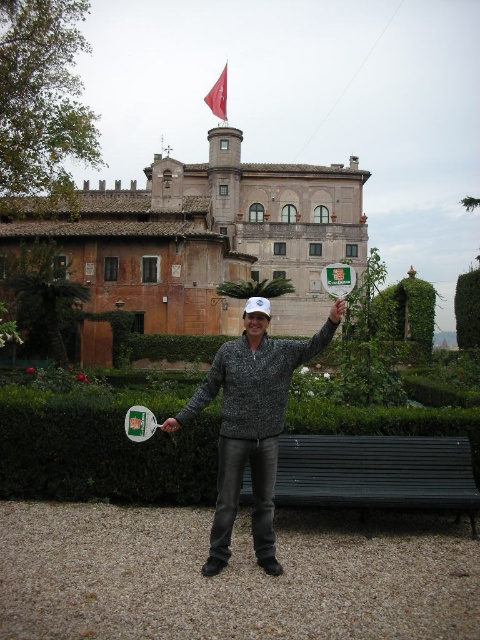
Does brown stone building at upper center have a larger size compared to red fabric flag at upper center?

Indeed, brown stone building at upper center has a larger size compared to red fabric flag at upper center.

Which is above, brown stone building at upper center or red fabric flag at upper center?

red fabric flag at upper center is above.

Describe the element at coordinates (207, 237) in the screenshot. I see `brown stone building at upper center` at that location.

Identify the location of brown stone building at upper center. (207, 237).

Can you confirm if black metal bench at lower center is bigger than red fabric flag at upper center?

No, black metal bench at lower center is not bigger than red fabric flag at upper center.

Which of these two, black metal bench at lower center or red fabric flag at upper center, stands taller?

With more height is red fabric flag at upper center.

Does point (298, 465) come behind point (225, 81)?

No.

Locate an element on the screen. black metal bench at lower center is located at coordinates (377, 474).

Where is `speckled sweater at center`? speckled sweater at center is located at coordinates (251, 422).

The image size is (480, 640). Describe the element at coordinates (251, 422) in the screenshot. I see `speckled sweater at center` at that location.

Which is in front, point (290, 369) or point (459, 288)?

Point (290, 369)

At what (x,y) coordinates should I click in order to perform the action: click on speckled sweater at center. Please return your answer as a coordinate pair (x, y). The height and width of the screenshot is (640, 480). Looking at the image, I should click on (251, 422).